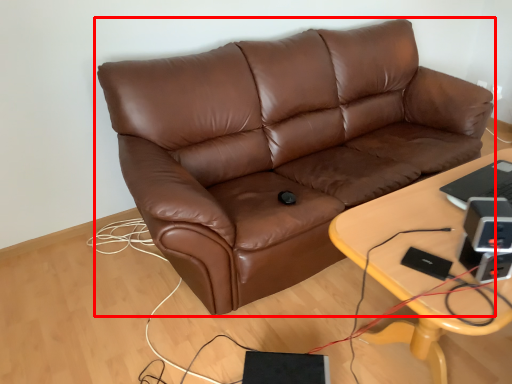
Question: Observing the image, what is the correct spatial positioning of studio couch (annotated by the red box) in reference to table?

Choices:
 (A) left
 (B) right

Answer: (A)